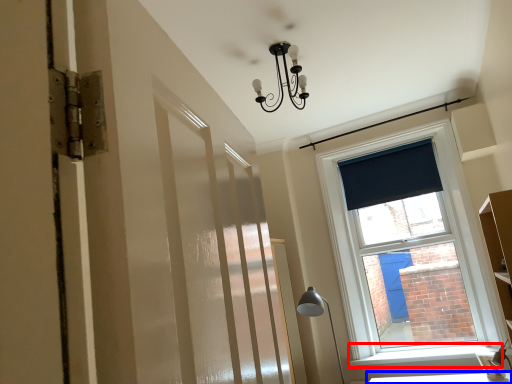
Question: Which object appears farthest to the camera in this image, window sill (highlighted by a red box) or table (highlighted by a blue box)?

Choices:
 (A) window sill
 (B) table

Answer: (A)